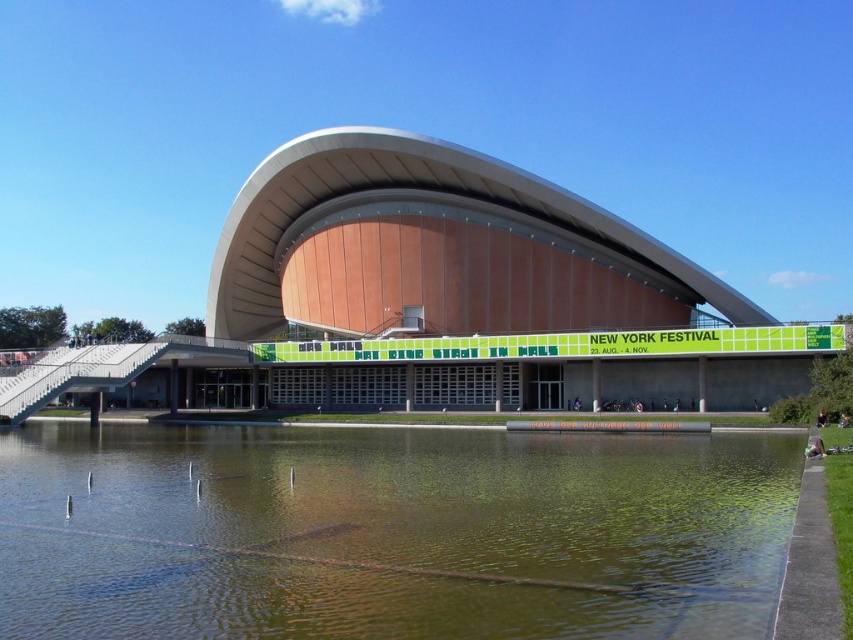
Is greenish water at lower center positioned at the back of matte orange building at center?

No, greenish water at lower center is in front of matte orange building at center.

Which is below, greenish water at lower center or matte orange building at center?

Positioned lower is greenish water at lower center.

Locate an element on the screen. This screenshot has width=853, height=640. greenish water at lower center is located at coordinates (389, 532).